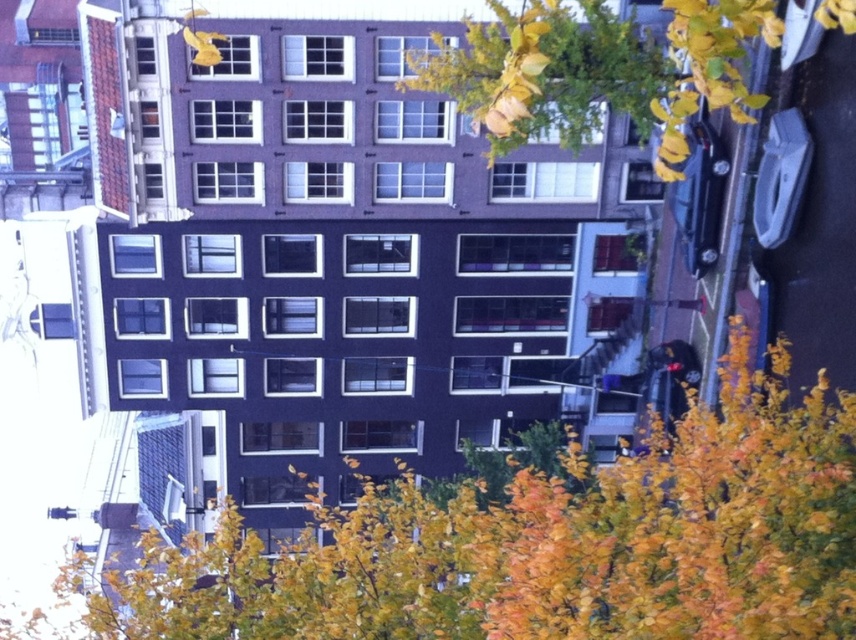
You are standing on the street and see two points marked in the image. The first point is at coordinates point (685,598) and the second is at point (492,100). Which point is closer to you?

Point (685,598) is in front of point (492,100), so it is closer to you.